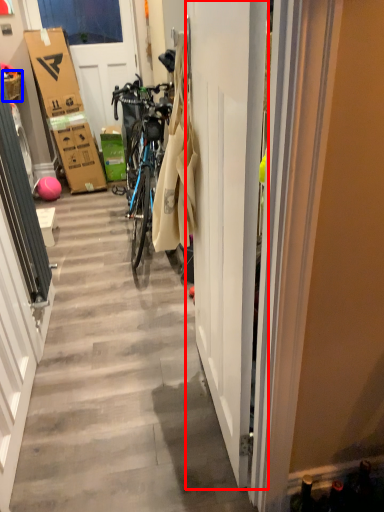
Question: Which object appears closest to the camera in this image, door (highlighted by a red box) or picnic basket (highlighted by a blue box)?

Choices:
 (A) door
 (B) picnic basket

Answer: (A)